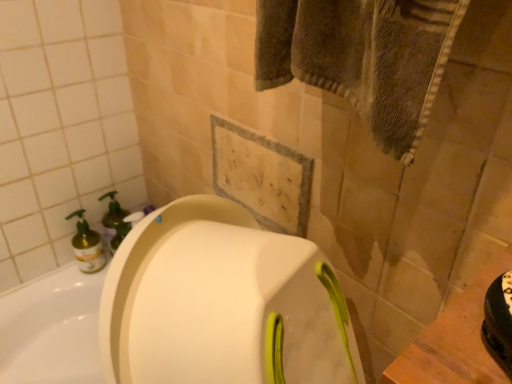
Question: From a real-world perspective, is translucent yellow bottle at left physically below translucent plastic soap dispenser at left?

Choices:
 (A) no
 (B) yes

Answer: (B)

Question: Does translucent yellow bottle at left have a greater width compared to translucent plastic soap dispenser at left?

Choices:
 (A) yes
 (B) no

Answer: (A)

Question: From a real-world perspective, is translucent yellow bottle at left physically above translucent plastic soap dispenser at left?

Choices:
 (A) yes
 (B) no

Answer: (B)

Question: Can you confirm if translucent yellow bottle at left is smaller than translucent plastic soap dispenser at left?

Choices:
 (A) no
 (B) yes

Answer: (B)

Question: From the image's perspective, is translucent yellow bottle at left under translucent plastic soap dispenser at left?

Choices:
 (A) no
 (B) yes

Answer: (B)

Question: Is the surface of translucent yellow bottle at left in direct contact with translucent plastic soap dispenser at left?

Choices:
 (A) yes
 (B) no

Answer: (A)

Question: Considering the relative positions of translucent plastic soap dispenser at left and translucent yellow bottle at left in the image provided, is translucent plastic soap dispenser at left to the right of translucent yellow bottle at left from the viewer's perspective?

Choices:
 (A) yes
 (B) no

Answer: (A)

Question: Does translucent plastic soap dispenser at left have a larger size compared to translucent yellow bottle at left?

Choices:
 (A) no
 (B) yes

Answer: (B)

Question: From a real-world perspective, is translucent plastic soap dispenser at left under translucent yellow bottle at left?

Choices:
 (A) no
 (B) yes

Answer: (A)

Question: Considering the relative sizes of translucent plastic soap dispenser at left and translucent yellow bottle at left in the image provided, is translucent plastic soap dispenser at left shorter than translucent yellow bottle at left?

Choices:
 (A) yes
 (B) no

Answer: (B)

Question: Is translucent plastic soap dispenser at left smaller than translucent yellow bottle at left?

Choices:
 (A) yes
 (B) no

Answer: (B)

Question: From the image's perspective, does translucent plastic soap dispenser at left appear lower than translucent yellow bottle at left?

Choices:
 (A) yes
 (B) no

Answer: (B)

Question: Considering the positions of translucent plastic soap dispenser at left and translucent yellow bottle at left in the image, is translucent plastic soap dispenser at left taller or shorter than translucent yellow bottle at left?

Choices:
 (A) short
 (B) tall

Answer: (B)